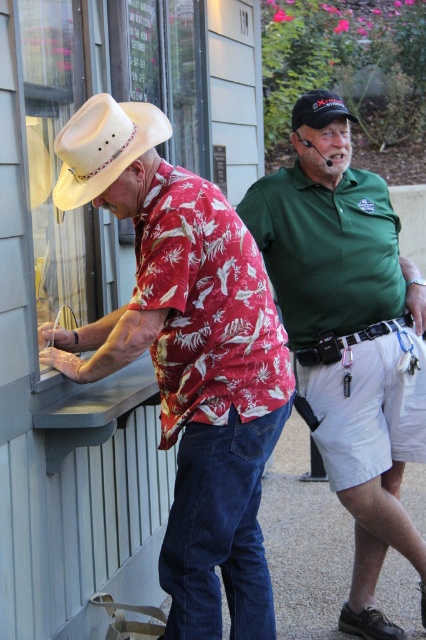
Question: Which is nearer to the black matte cap at upper center?

Choices:
 (A) green cotton shirt at center
 (B) black leather belt at center
 (C) light brown felt cowboy hat at left
 (D) matte white cowboy hat at left

Answer: (B)

Question: Is matte white cowboy hat at left bigger than light brown felt cowboy hat at left?

Choices:
 (A) no
 (B) yes

Answer: (B)

Question: Observing the image, what is the correct spatial positioning of black leather belt at center in reference to black matte cap at upper center?

Choices:
 (A) below
 (B) above

Answer: (A)

Question: Which of these objects is positioned closest to the green cotton shirt at center?

Choices:
 (A) matte white cowboy hat at left
 (B) light brown felt cowboy hat at left
 (C) black leather belt at center

Answer: (C)

Question: Is green cotton shirt at center positioned at the back of light brown felt cowboy hat at left?

Choices:
 (A) no
 (B) yes

Answer: (B)

Question: Which object is farther from the camera taking this photo?

Choices:
 (A) light brown felt cowboy hat at left
 (B) matte white cowboy hat at left
 (C) green cotton shirt at center
 (D) black matte cap at upper center

Answer: (C)